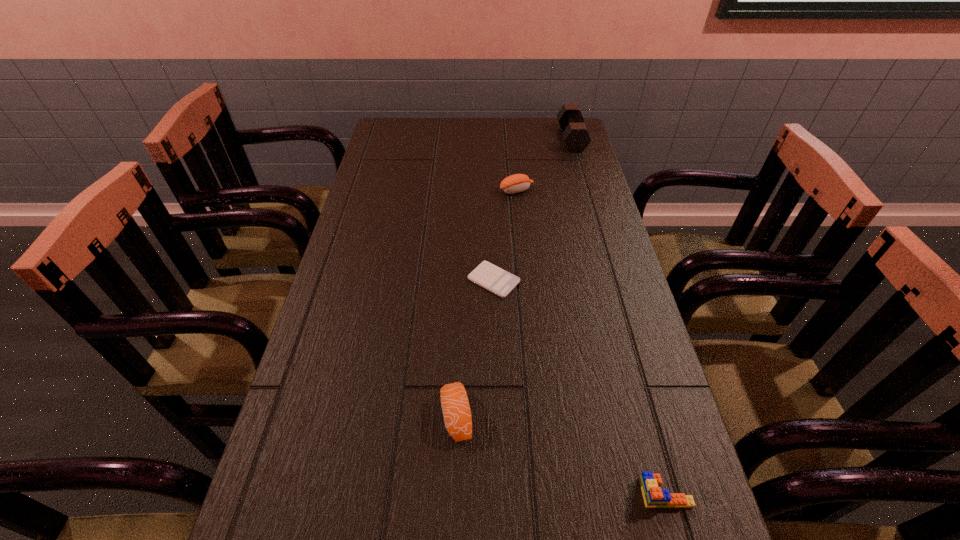
This screenshot has width=960, height=540. What are the coordinates of `free space at the right edge` in the screenshot? It's located at (583, 167).

Locate an element on the screen. The image size is (960, 540). blank space at the far left corner of the desktop is located at coordinates click(x=384, y=129).

Where is `vacant point located between the dumbbell and the Lego`? vacant point located between the dumbbell and the Lego is located at coordinates (618, 316).

Image resolution: width=960 pixels, height=540 pixels. What are the coordinates of `free area in between the Lego and the tallest object` in the screenshot? It's located at (618, 316).

I want to click on free space that is in between the third nearest object and the dumbbell, so click(x=533, y=210).

Where is `empty space between the third nearest object and the farthest object`? This screenshot has width=960, height=540. empty space between the third nearest object and the farthest object is located at coordinates (533, 210).

This screenshot has width=960, height=540. In order to click on vacant area that lies between the nearer sushi and the farther sushi in this screenshot , I will do `click(487, 303)`.

Identify the location of free space between the left sushi and the farther sushi. Image resolution: width=960 pixels, height=540 pixels. (487, 303).

Where is `free spot between the left sushi and the second farthest object`? free spot between the left sushi and the second farthest object is located at coordinates (487, 303).

At what (x,y) coordinates should I click in order to perform the action: click on free space that is in between the right sushi and the left sushi. Please return your answer as a coordinate pair (x, y). The height and width of the screenshot is (540, 960). Looking at the image, I should click on (487, 303).